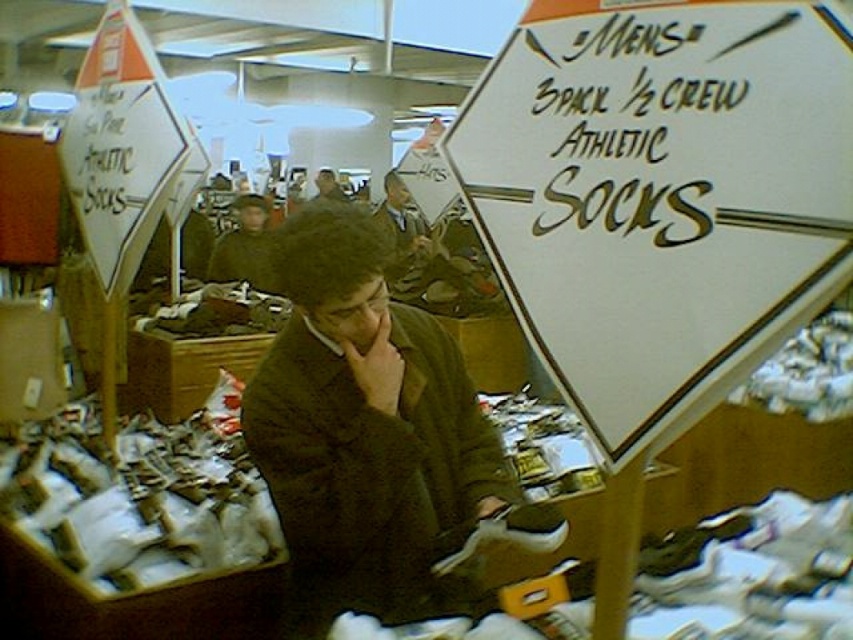
Question: Can you confirm if brown fuzzy jacket at center is thinner than white leather shoe at lower center?

Choices:
 (A) no
 (B) yes

Answer: (A)

Question: Which is nearer to the brown fuzzy jacket at center?

Choices:
 (A) white leather shoe at lower center
 (B) white paper sign at upper right

Answer: (A)

Question: Which point is farther to the camera?

Choices:
 (A) brown fuzzy jacket at center
 (B) brown fuzzy hat at upper center

Answer: (B)

Question: Among these objects, which one is farthest from the camera?

Choices:
 (A) white paper sign at upper right
 (B) brown fuzzy hat at upper center
 (C) white leather shoe at lower center
 (D) dark brown jacket at center

Answer: (B)

Question: Considering the relative positions of white leather shoe at lower center and dark brown jacket at center in the image provided, where is white leather shoe at lower center located with respect to dark brown jacket at center?

Choices:
 (A) right
 (B) left

Answer: (A)

Question: Does white paper sign at upper right have a lesser width compared to brown fuzzy hat at upper center?

Choices:
 (A) yes
 (B) no

Answer: (A)